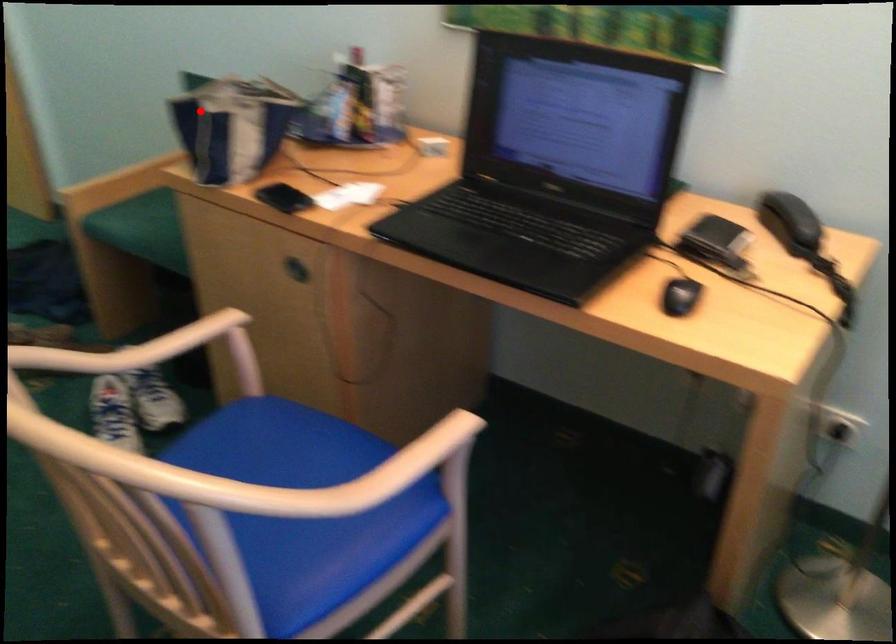
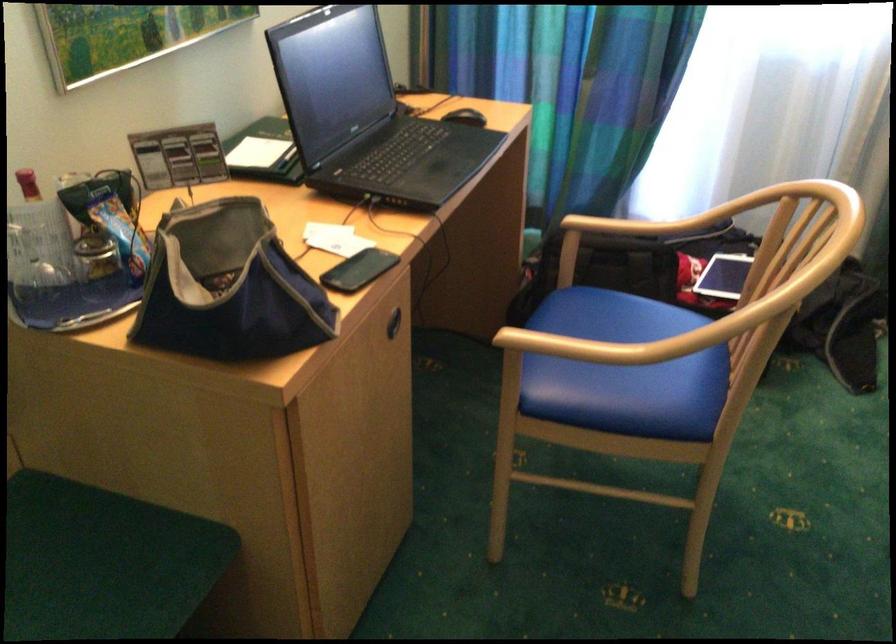
In the second image, find the point that corresponds to the highlighted location in the first image.

(228, 287)